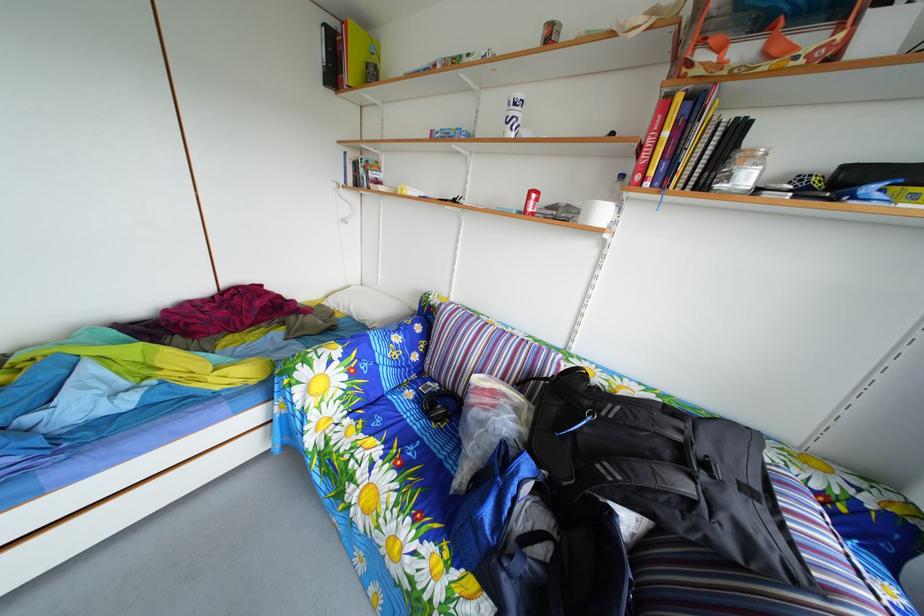
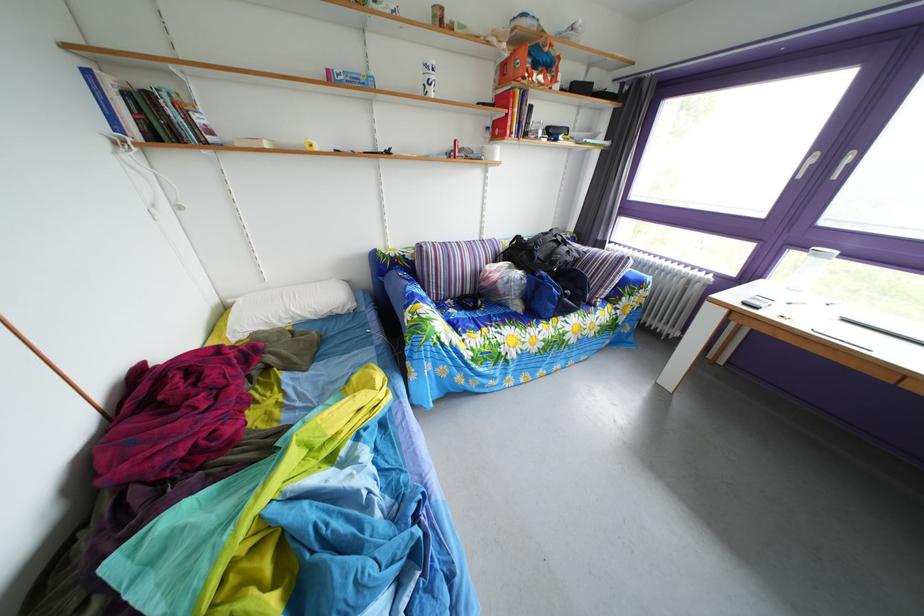
The point at (443, 140) is marked in the first image. Where is the corresponding point in the second image?

(339, 79)